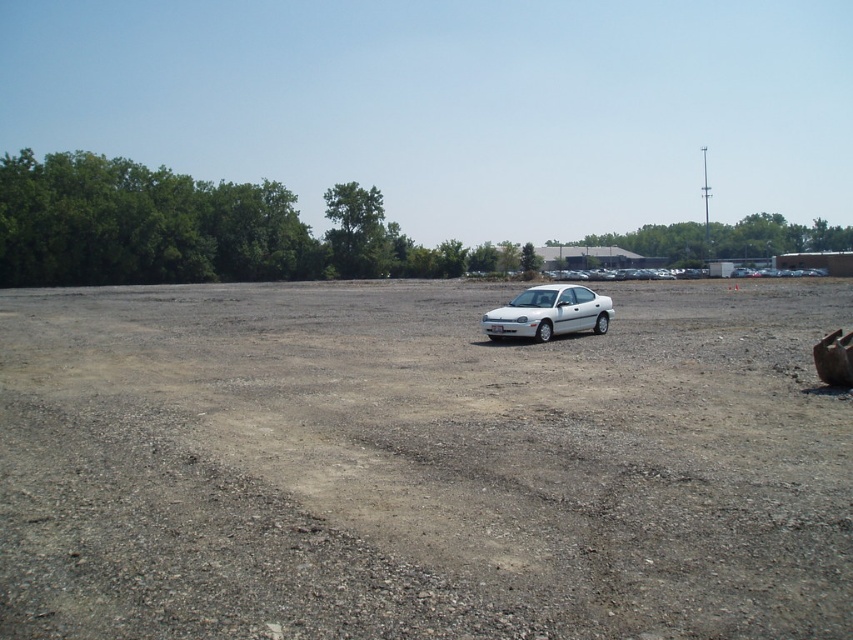
Question: Which point is closer to the camera taking this photo?

Choices:
 (A) (529, 320)
 (B) (422, 408)

Answer: (B)

Question: Can you confirm if gray gravelly dirt field at center is bigger than white matte car at center?

Choices:
 (A) no
 (B) yes

Answer: (B)

Question: Can you confirm if gray gravelly dirt field at center is positioned above white matte car at center?

Choices:
 (A) no
 (B) yes

Answer: (A)

Question: Which of the following is the farthest from the observer?

Choices:
 (A) white matte car at center
 (B) gray gravelly dirt field at center

Answer: (A)

Question: Does gray gravelly dirt field at center have a greater width compared to white matte car at center?

Choices:
 (A) yes
 (B) no

Answer: (A)

Question: Which point is closer to the camera?

Choices:
 (A) gray gravelly dirt field at center
 (B) white matte car at center

Answer: (A)